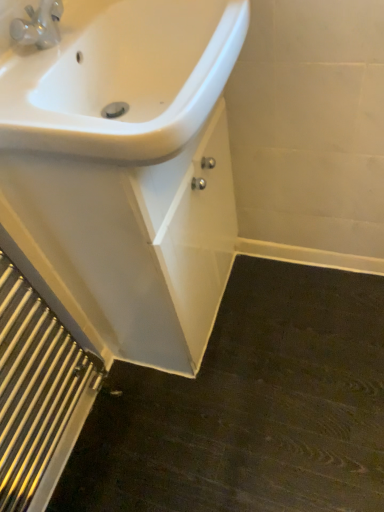
Question: Considering the positions of white glossy sink at upper left and white glossy sink at upper left in the image, is white glossy sink at upper left taller or shorter than white glossy sink at upper left?

Choices:
 (A) tall
 (B) short

Answer: (B)

Question: From the image's perspective, is white glossy sink at upper left located above or below white glossy sink at upper left?

Choices:
 (A) below
 (B) above

Answer: (B)

Question: Which of these objects is positioned farthest from the polished silver radiator at lower left?

Choices:
 (A) white glossy sink at upper left
 (B) white glossy sink at upper left

Answer: (B)

Question: Estimate the real-world distances between objects in this image. Which object is farther from the white glossy sink at upper left?

Choices:
 (A) polished silver radiator at lower left
 (B) white glossy sink at upper left

Answer: (A)